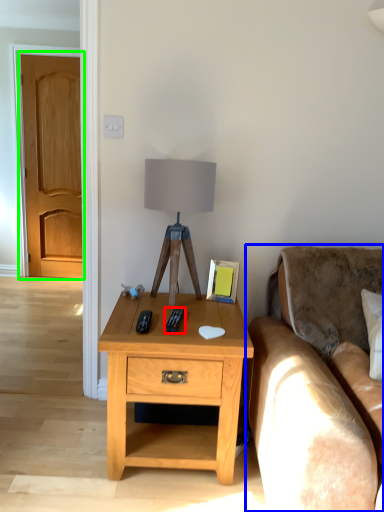
Question: Considering the real-world distances, which object is farthest from remote (highlighted by a red box)? studio couch (highlighted by a blue box) or door (highlighted by a green box)?

Choices:
 (A) studio couch
 (B) door

Answer: (B)